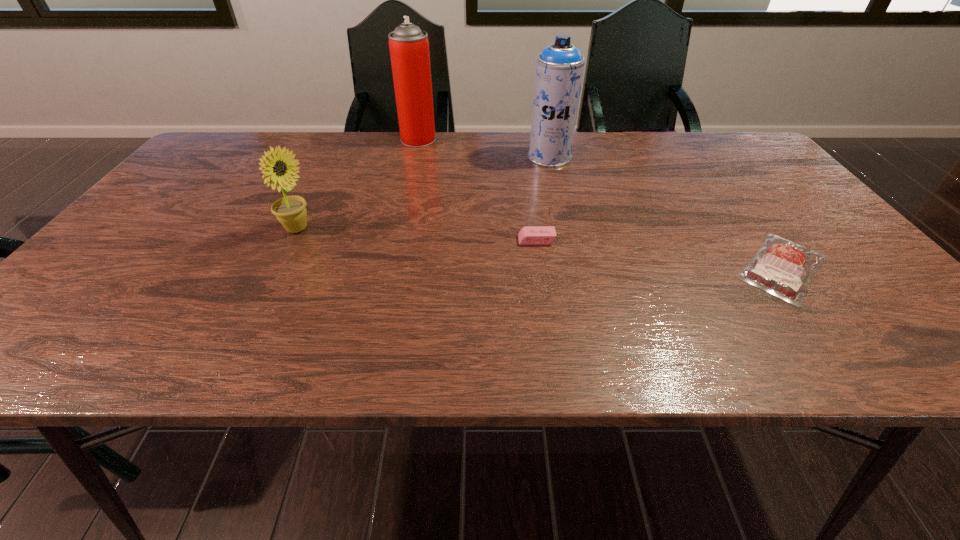
Identify the location of free spot that satisfies the following two spatial constraints: 1. on the face of the sunflower; 2. on the right side of the steak. Image resolution: width=960 pixels, height=540 pixels. (277, 268).

Find the location of `vacant space that satisfies the following two spatial constraints: 1. on the face of the leftmost object; 2. on the back side of the rightmost object`. vacant space that satisfies the following two spatial constraints: 1. on the face of the leftmost object; 2. on the back side of the rightmost object is located at coordinates (277, 268).

Identify the location of vacant area that satisfies the following two spatial constraints: 1. on the face of the third tallest object; 2. on the left side of the steak. (277, 268).

Where is `free location that satisfies the following two spatial constraints: 1. on the front side of the eraser; 2. on the right side of the rightmost object`? free location that satisfies the following two spatial constraints: 1. on the front side of the eraser; 2. on the right side of the rightmost object is located at coordinates (540, 268).